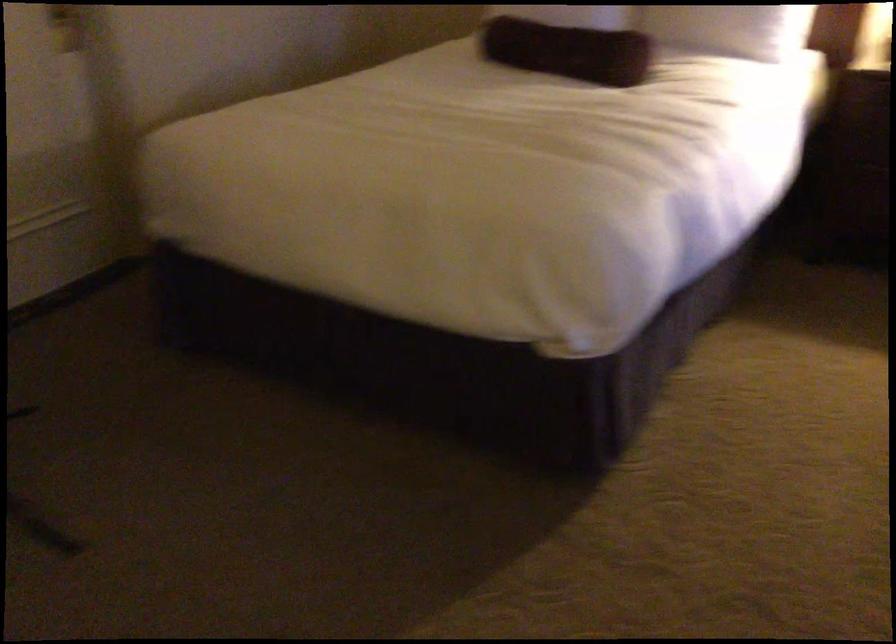
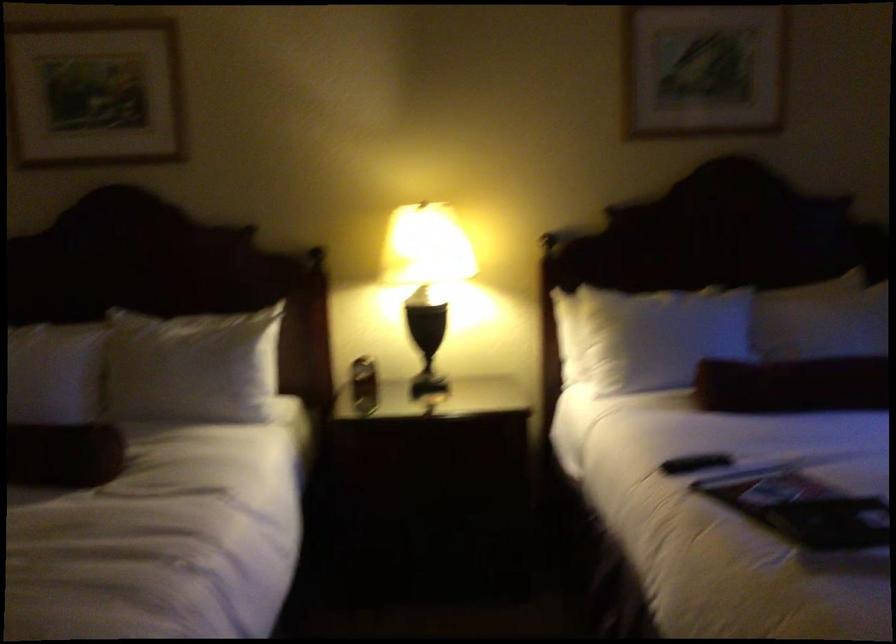
The first image is from the beginning of the video and the second image is from the end. How did the camera likely rotate when shooting the video?

The camera rotated toward right-up.